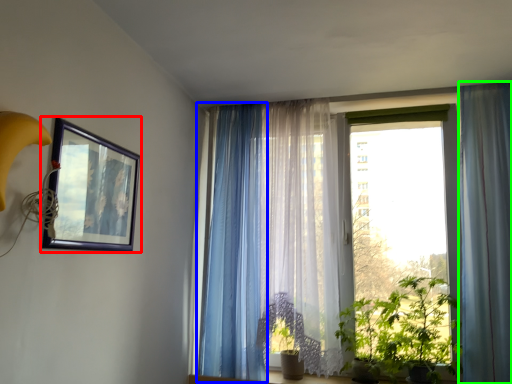
Question: Which object is the closest to the picture frame (highlighted by a red box)? Choose among these: curtain (highlighted by a blue box) or curtain (highlighted by a green box).

Choices:
 (A) curtain
 (B) curtain

Answer: (A)